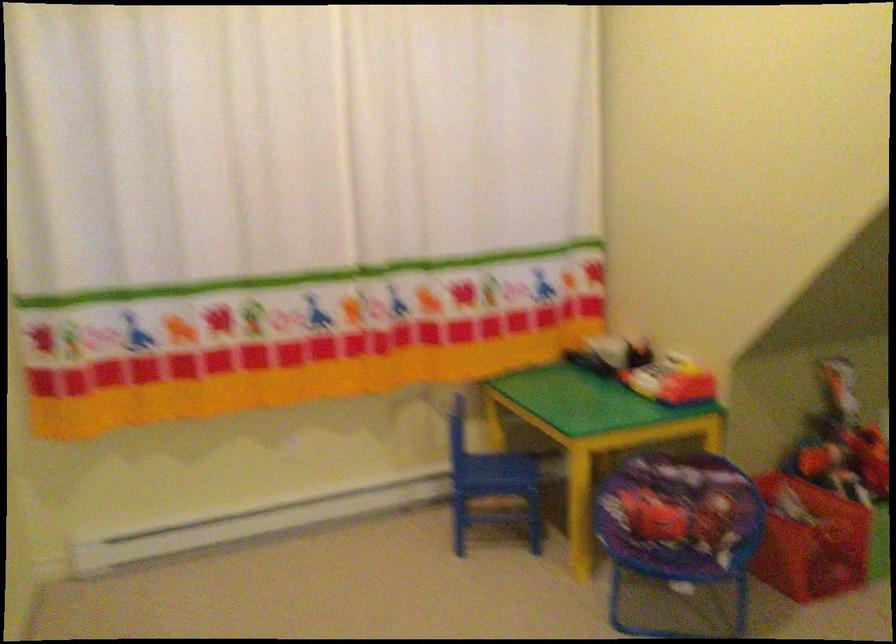
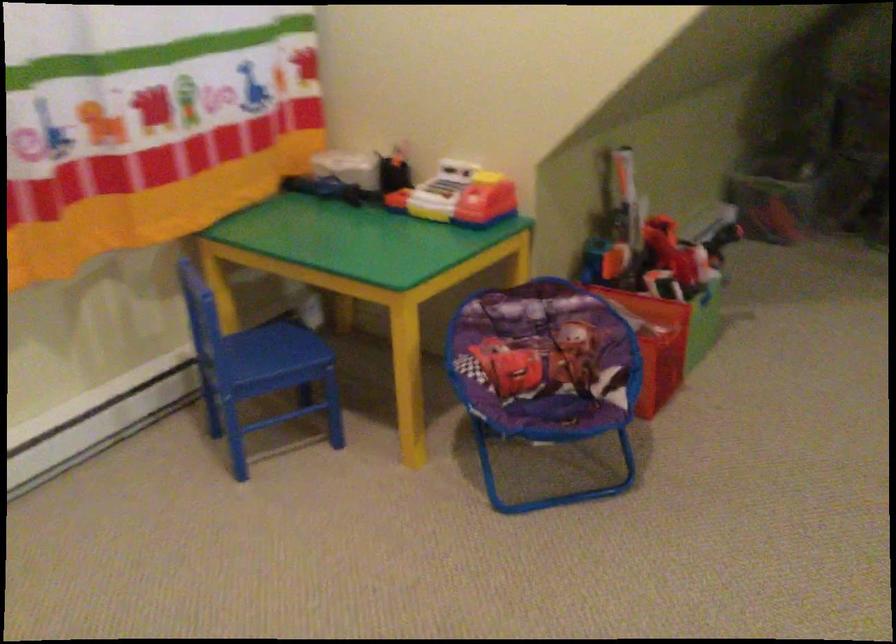
Locate, in the second image, the point that corresponds to point 694,536 in the first image.

(546, 372)